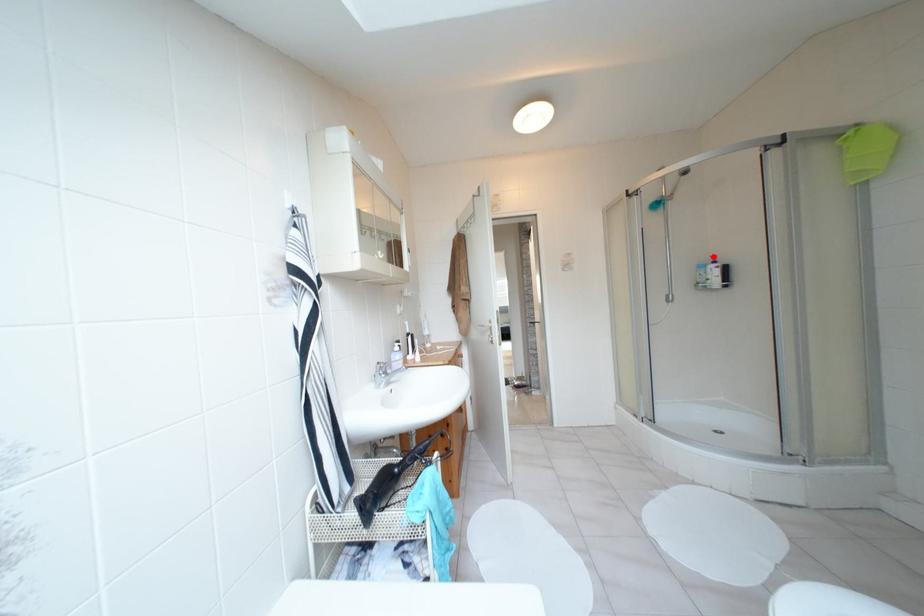
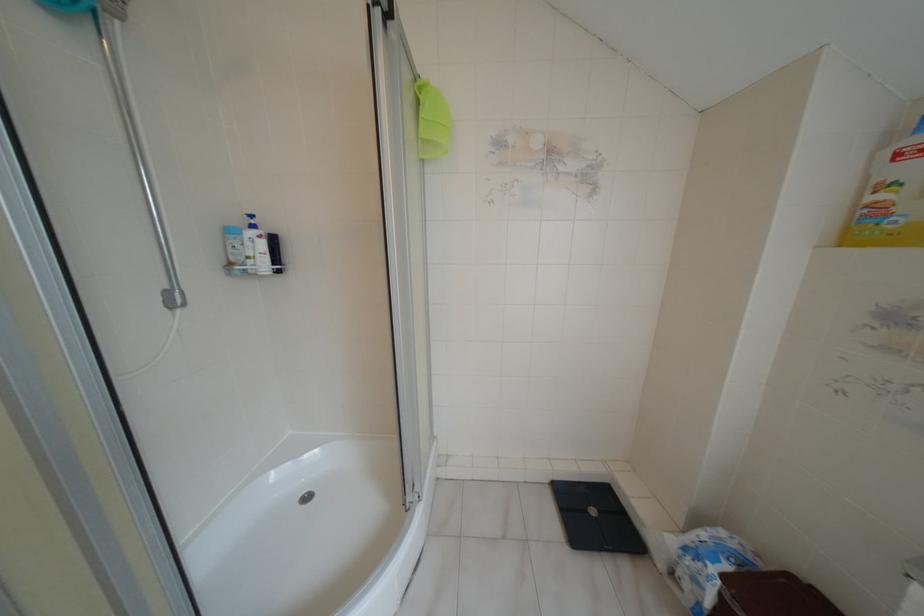
Where in the second image is the point corresponding to the highlighted location from the first image?

(251, 216)